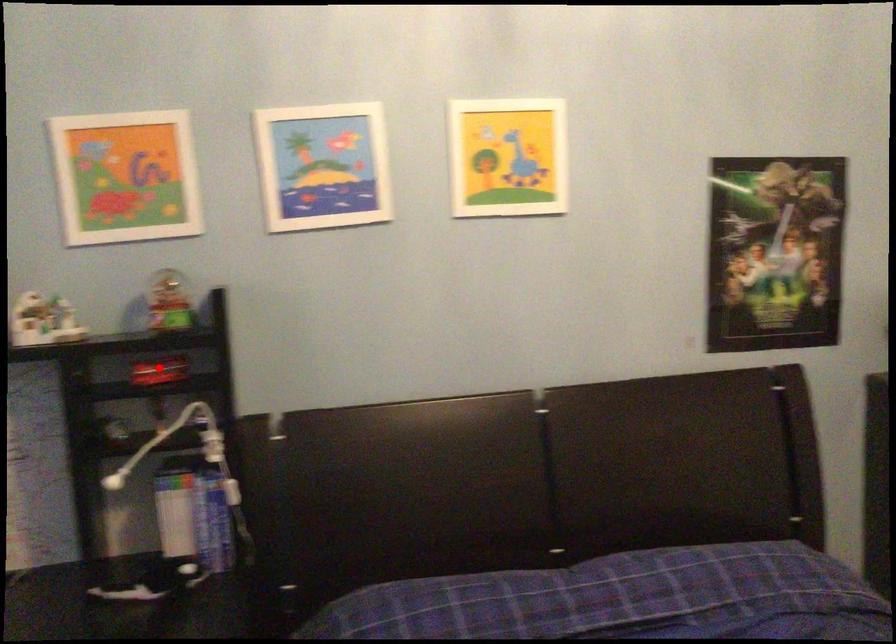
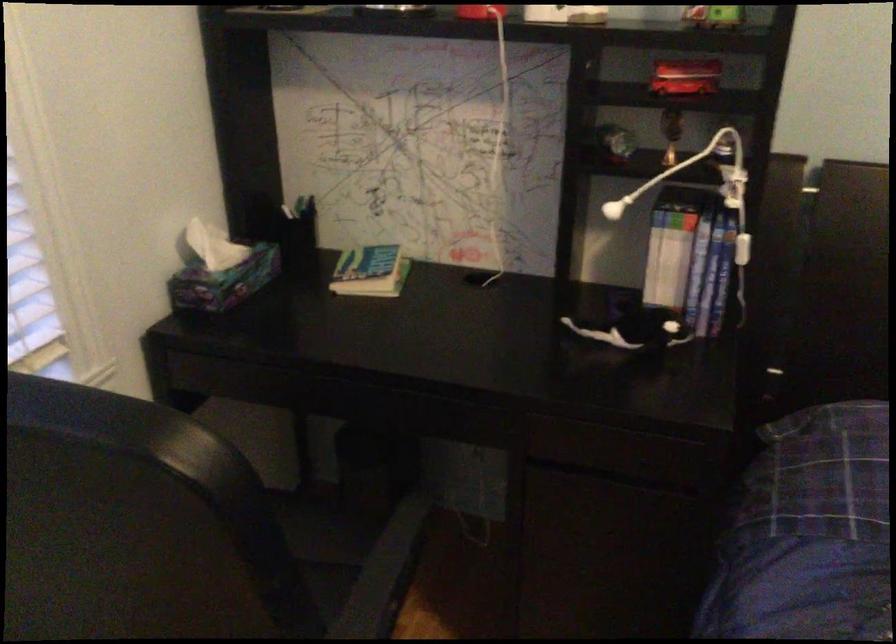
Find the pixel in the second image that matches the highlighted location in the first image.

(685, 77)